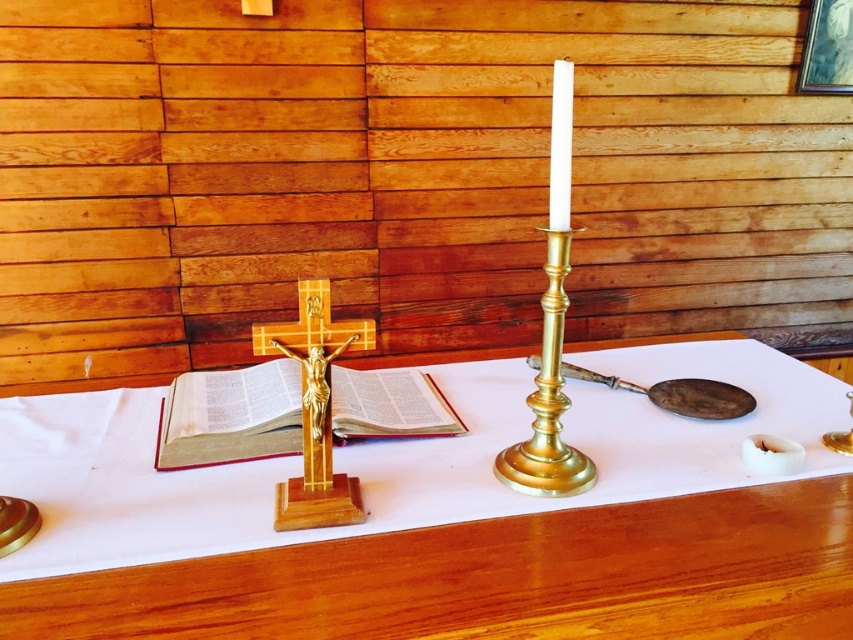
Question: Is matte gold book at center wider than gold polished wood crucifix at center?

Choices:
 (A) yes
 (B) no

Answer: (A)

Question: Among these points, which one is farthest from the camera?

Choices:
 (A) (302, 314)
 (B) (155, 465)
 (C) (585, 483)
 (D) (550, 170)

Answer: (B)

Question: Which of the following is the closest to the observer?

Choices:
 (A) (567, 154)
 (B) (552, 492)
 (C) (282, 636)

Answer: (C)

Question: Can you confirm if matte gold book at center is positioned below gold polished wood crucifix at center?

Choices:
 (A) yes
 (B) no

Answer: (A)

Question: In this image, where is matte gold book at center located relative to gold polished brass candle holder at center?

Choices:
 (A) right
 (B) left

Answer: (B)

Question: Among these objects, which one is nearest to the camera?

Choices:
 (A) gold polished wood crucifix at center
 (B) white cloth at center

Answer: (B)